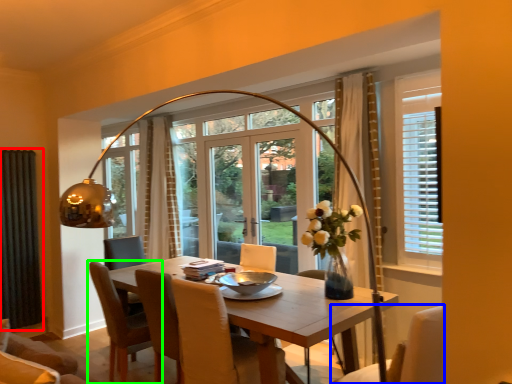
Question: Estimate the real-world distances between objects in this image. Which object is closer to curtain (highlighted by a red box), chair (highlighted by a blue box) or chair (highlighted by a green box)?

Choices:
 (A) chair
 (B) chair

Answer: (B)